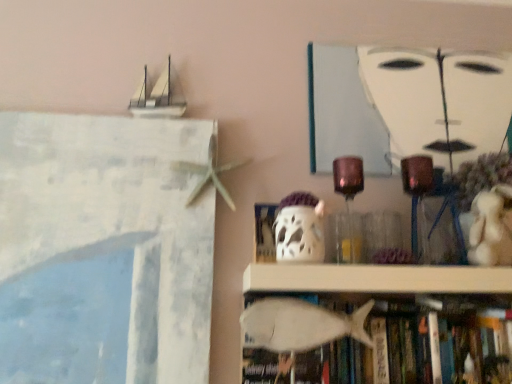
Question: Is white matte fish at lower center not close to white matte painting at upper center?

Choices:
 (A) no
 (B) yes

Answer: (A)

Question: Can you confirm if white matte fish at lower center is thinner than white matte painting at upper center?

Choices:
 (A) yes
 (B) no

Answer: (B)

Question: From a real-world perspective, is white matte fish at lower center physically above white matte painting at upper center?

Choices:
 (A) no
 (B) yes

Answer: (A)

Question: From the image's perspective, does white matte fish at lower center appear lower than white matte painting at upper center?

Choices:
 (A) no
 (B) yes

Answer: (B)

Question: Considering the relative sizes of white matte fish at lower center and white matte painting at upper center in the image provided, is white matte fish at lower center taller than white matte painting at upper center?

Choices:
 (A) no
 (B) yes

Answer: (A)

Question: Considering the positions of white matte fish at lower center and white matte ghost at center in the image, is white matte fish at lower center bigger or smaller than white matte ghost at center?

Choices:
 (A) big
 (B) small

Answer: (A)

Question: From the image's perspective, is white matte fish at lower center located above or below white matte ghost at center?

Choices:
 (A) below
 (B) above

Answer: (A)

Question: From their relative heights in the image, would you say white matte fish at lower center is taller or shorter than white matte ghost at center?

Choices:
 (A) tall
 (B) short

Answer: (A)

Question: From a real-world perspective, is white matte fish at lower center positioned above or below white matte ghost at center?

Choices:
 (A) below
 (B) above

Answer: (A)

Question: From a real-world perspective, is white plush bear at right positioned above or below white matte ghost at center?

Choices:
 (A) above
 (B) below

Answer: (A)

Question: From the image's perspective, relative to white matte ghost at center, is white plush bear at right above or below?

Choices:
 (A) below
 (B) above

Answer: (B)

Question: Considering the positions of white plush bear at right and white matte ghost at center in the image, is white plush bear at right wider or thinner than white matte ghost at center?

Choices:
 (A) wide
 (B) thin

Answer: (A)

Question: In the image, is white plush bear at right positioned in front of or behind white matte ghost at center?

Choices:
 (A) behind
 (B) front

Answer: (A)

Question: Considering the positions of white matte ghost at center and white matte fish at lower center in the image, is white matte ghost at center taller or shorter than white matte fish at lower center?

Choices:
 (A) short
 (B) tall

Answer: (A)

Question: Considering the positions of point (298, 256) and point (418, 301), is point (298, 256) closer or farther from the camera than point (418, 301)?

Choices:
 (A) farther
 (B) closer

Answer: (B)